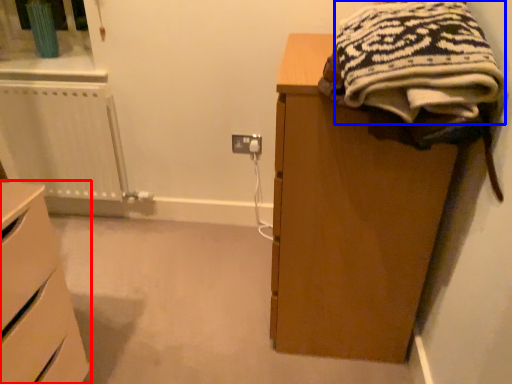
Question: Among these objects, which one is farthest to the camera, chest of drawers (highlighted by a red box) or clothing (highlighted by a blue box)?

Choices:
 (A) chest of drawers
 (B) clothing

Answer: (A)